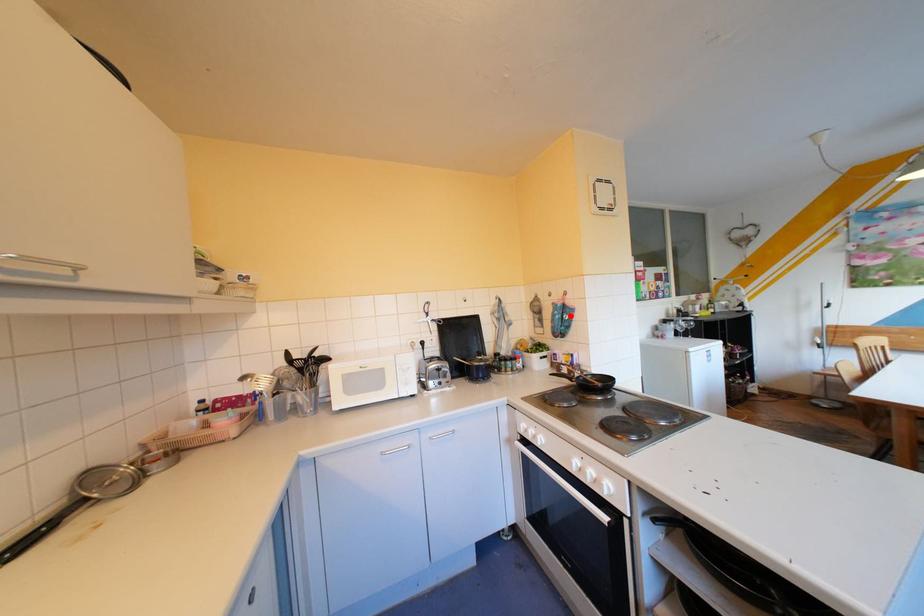
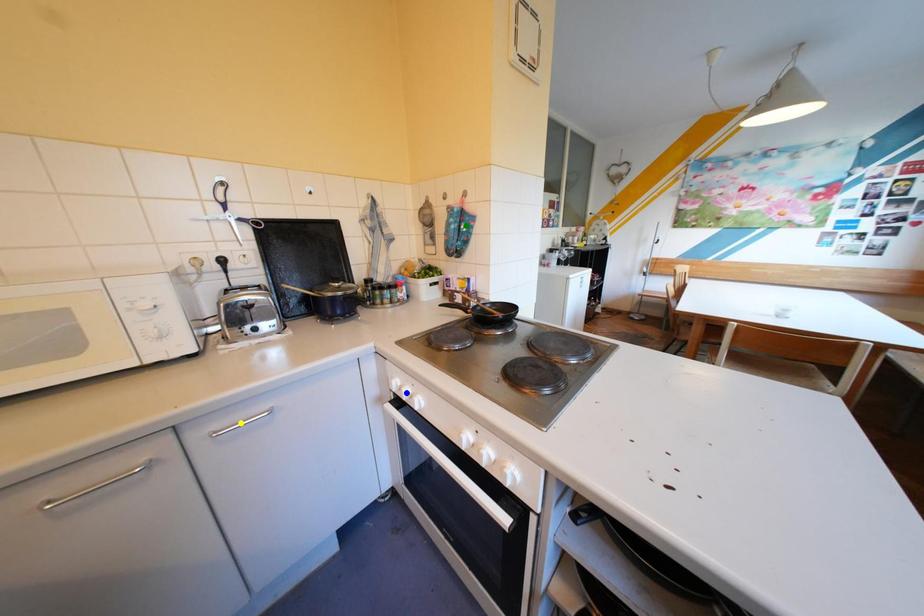
Question: I am providing you with two images of the same scene from different viewpoints. A red point is marked on the first image. You are given multiple points on the second image. Can you choose the point in image 2 that corresponds to the point in image 1?

Choices:
 (A) yellow point
 (B) green point
 (C) blue point

Answer: (B)